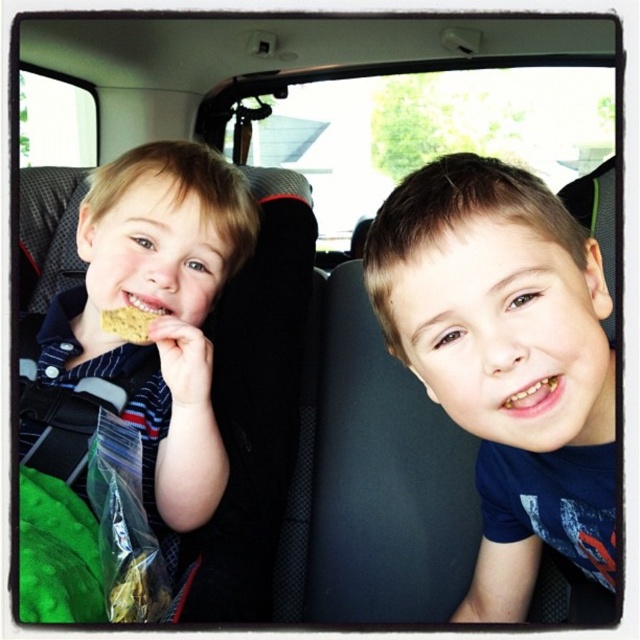
Does blue matte shirt at center have a greater width compared to matte brown hair at left?

Incorrect, blue matte shirt at center's width does not surpass matte brown hair at left's.

Who is more distant from viewer, (531, 305) or (180, 387)?

The point (180, 387) is behind.

The height and width of the screenshot is (640, 640). I want to click on blue matte shirt at center, so click(x=506, y=360).

Is the position of matte brown hair at left less distant than that of golden cracker at mouth?

That is True.

At what (x,y) coordinates should I click in order to perform the action: click on matte brown hair at left. Please return your answer as a coordinate pair (x, y). Looking at the image, I should click on (148, 330).

Identify the location of blue matte shirt at center. (506, 360).

Is point (540, 362) in front of point (132, 337)?

Yes.

Image resolution: width=640 pixels, height=640 pixels. Identify the location of blue matte shirt at center. (506, 360).